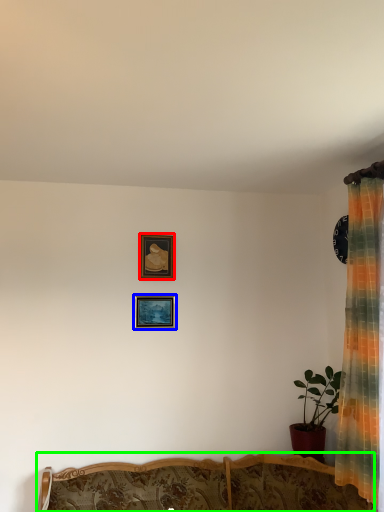
Question: Which object is the farthest from picture frame (highlighted by a red box)? Choose among these: picture frame (highlighted by a blue box) or furniture (highlighted by a green box).

Choices:
 (A) picture frame
 (B) furniture

Answer: (B)